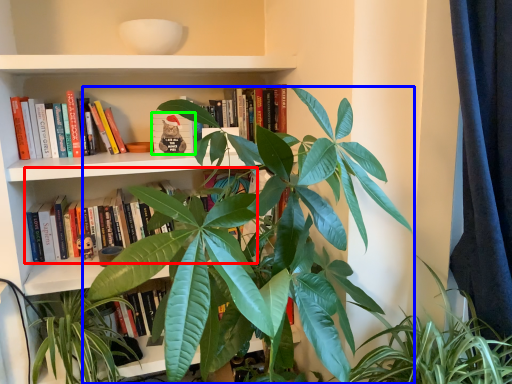
Question: Which object is positioned farthest from book (highlighted by a red box)? Select from houseplant (highlighted by a blue box) and book (highlighted by a green box).

Choices:
 (A) houseplant
 (B) book

Answer: (A)